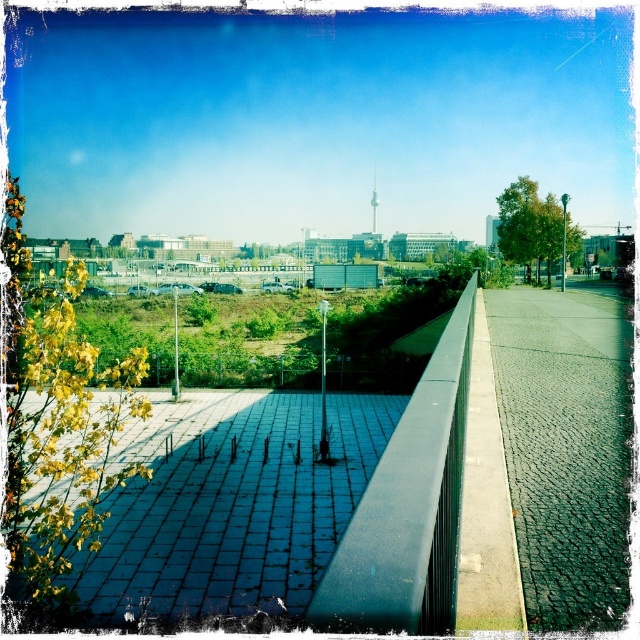
Question: Which of the following is the farthest from the observer?

Choices:
 (A) (376, 224)
 (B) (525, 456)
 (C) (355, 547)

Answer: (A)

Question: Is cobblestone pavement at center above white glass tv tower at center?

Choices:
 (A) no
 (B) yes

Answer: (A)

Question: Considering the relative positions of black metal ledge at center and white glass tv tower at center in the image provided, where is black metal ledge at center located with respect to white glass tv tower at center?

Choices:
 (A) above
 (B) below

Answer: (B)

Question: Among these objects, which one is nearest to the camera?

Choices:
 (A) dark gray paving stone at center
 (B) black metal ledge at center
 (C) cobblestone pavement at center

Answer: (B)

Question: Which object appears closest to the camera in this image?

Choices:
 (A) black metal ledge at center
 (B) cobblestone pavement at center

Answer: (A)

Question: Is cobblestone pavement at center bigger than black metal ledge at center?

Choices:
 (A) no
 (B) yes

Answer: (B)